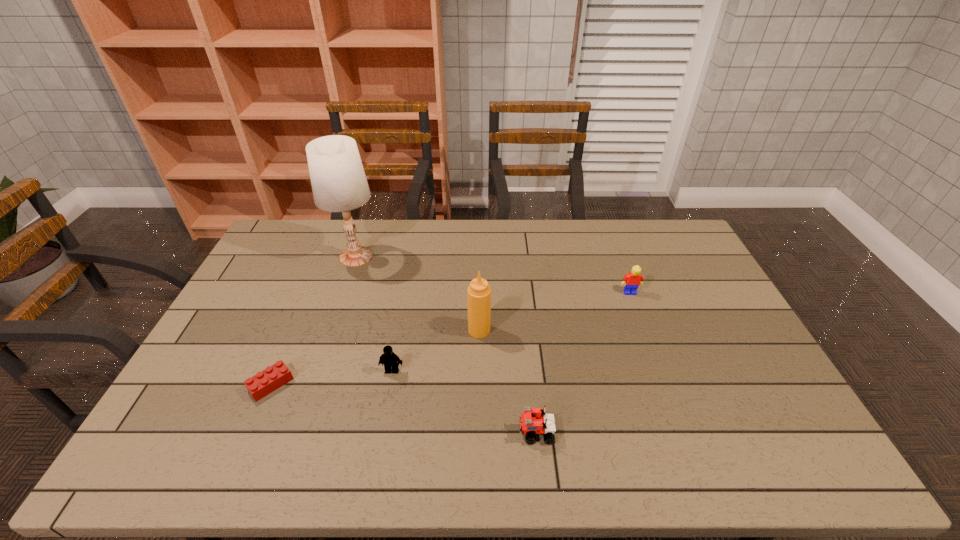
The height and width of the screenshot is (540, 960). Identify the location of free space between the tallest object and the third Lego from right to left. (374, 314).

I want to click on free space that is in between the rightmost Lego and the third object from right to left, so click(x=555, y=312).

This screenshot has width=960, height=540. What are the coordinates of `empty space that is in between the third object from right to left and the shortest Lego` in the screenshot? It's located at (375, 357).

Identify the location of vacant area between the third Lego from right to left and the condiment. (436, 350).

The height and width of the screenshot is (540, 960). What are the coordinates of `free spot between the fourth nearest object and the second Lego from left to right` in the screenshot? It's located at (436, 350).

At what (x,y) coordinates should I click in order to perform the action: click on unoccupied position between the shortest Lego and the third object from left to right. Please return your answer as a coordinate pair (x, y). Looking at the image, I should click on (331, 377).

Locate an element on the screen. Image resolution: width=960 pixels, height=540 pixels. vacant region between the third Lego from right to left and the shortest object is located at coordinates (331, 377).

At what (x,y) coordinates should I click in order to perform the action: click on object that stands as the fifth closest to the rightmost Lego. Please return your answer as a coordinate pair (x, y). This screenshot has width=960, height=540. Looking at the image, I should click on (273, 377).

Locate which object ranks in proximity to the tallest object. Please provide its 2D coordinates. Your answer should be formatted as a tuple, i.e. [(x, y)], where the tuple contains the x and y coordinates of a point satisfying the conditions above.

[(478, 292)]

Identify which Lego is the closest to the rightmost Lego. Please provide its 2D coordinates. Your answer should be formatted as a tuple, i.e. [(x, y)], where the tuple contains the x and y coordinates of a point satisfying the conditions above.

[(533, 421)]